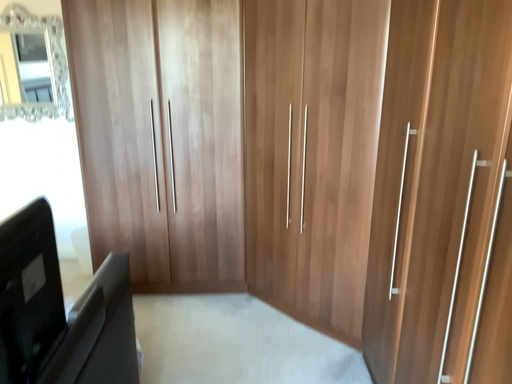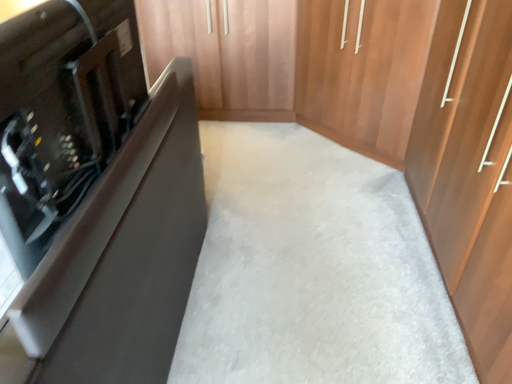
Question: How did the camera likely rotate when shooting the video?

Choices:
 (A) rotated upward
 (B) rotated downward

Answer: (B)